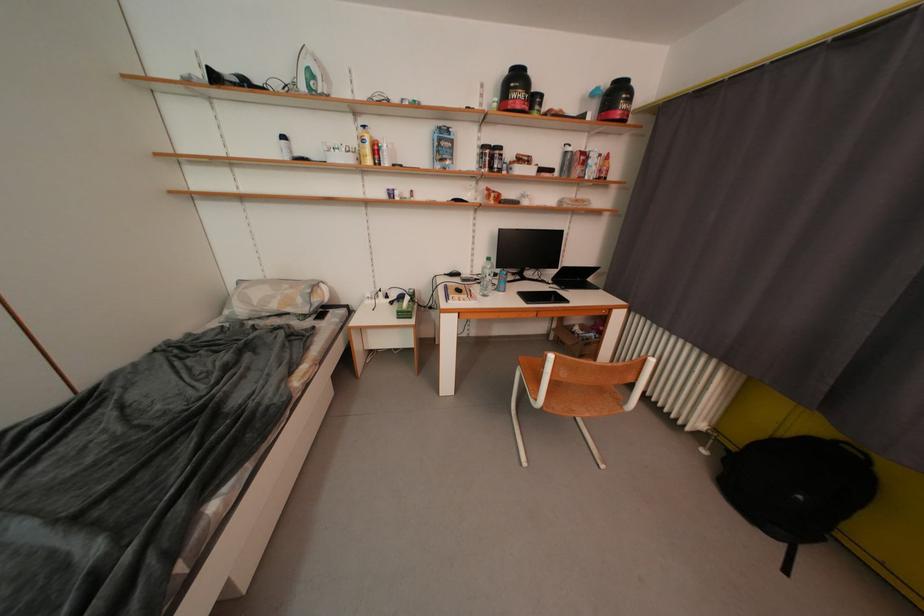
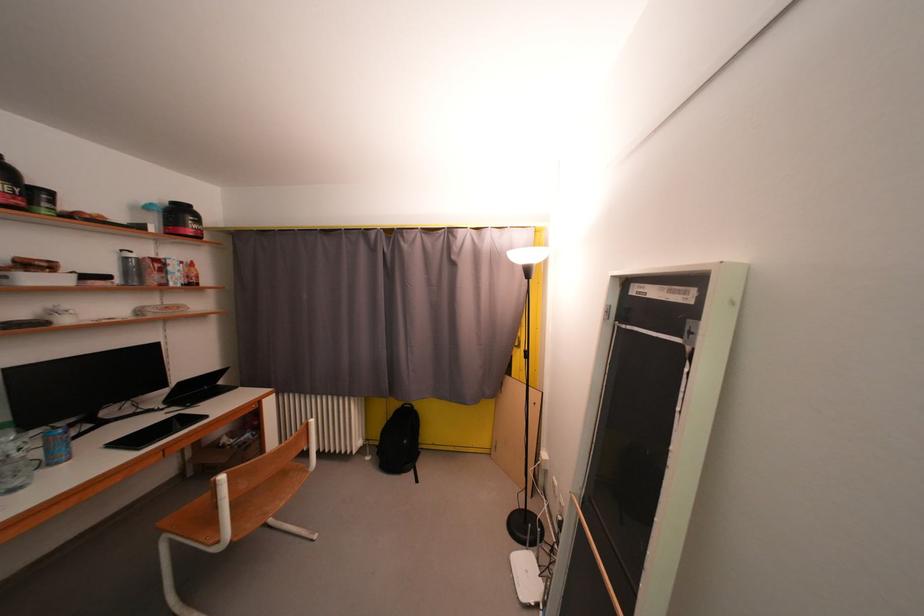
The point at (736, 454) is marked in the first image. Where is the corresponding point in the second image?

(384, 450)